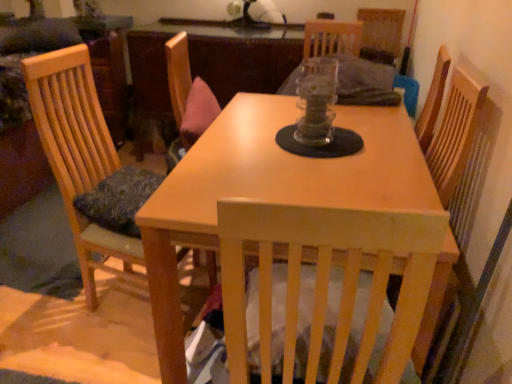
You are a GUI agent. You are given a task and a screenshot of the screen. Output one action in this format:
    pyautogui.click(x=<x>, y=<y>)
    Task: Click on the free space above light wood table at center (from a real-world perspective)
    
    Given the screenshot: What is the action you would take?
    coord(297,155)